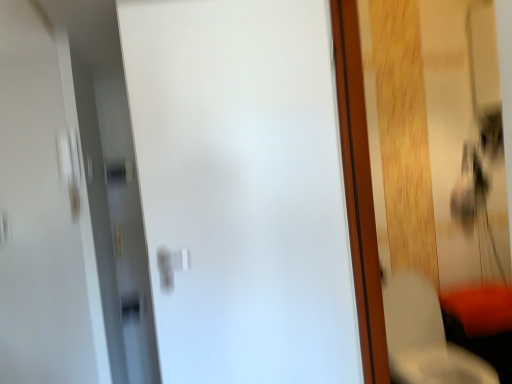
What is the approximate height of white fabric armchair at lower right?

white fabric armchair at lower right is 28.96 inches in height.

What do you see at coordinates (425, 338) in the screenshot? I see `white fabric armchair at lower right` at bounding box center [425, 338].

Image resolution: width=512 pixels, height=384 pixels. Find the location of `white fabric armchair at lower right`. white fabric armchair at lower right is located at coordinates (425, 338).

Where is `white fabric armchair at lower right`? This screenshot has width=512, height=384. white fabric armchair at lower right is located at coordinates (425, 338).